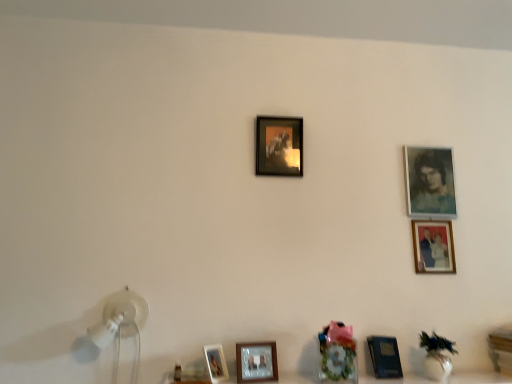
Question: Is blue textured portrait at upper right, the first picture frame when ordered from right to left, placed right next to matte glass picture frame at center, which appears as the third picture frame when ordered from the bottom?

Choices:
 (A) no
 (B) yes

Answer: (A)

Question: Is blue textured portrait at upper right, which ranks as the second picture frame in top-to-bottom order, facing towards matte glass picture frame at center, the 5th picture frame positioned from the right?

Choices:
 (A) no
 (B) yes

Answer: (A)

Question: Are blue textured portrait at upper right, which appears as the sixth picture frame when viewed from the left, and matte glass picture frame at center, the 5th picture frame positioned from the right, far apart?

Choices:
 (A) no
 (B) yes

Answer: (A)

Question: Considering the relative sizes of blue textured portrait at upper right, which ranks as the second picture frame in top-to-bottom order, and matte glass picture frame at center, which ranks as the 2th picture frame in left-to-right order, in the image provided, is blue textured portrait at upper right, which ranks as the second picture frame in top-to-bottom order, thinner than matte glass picture frame at center, which ranks as the 2th picture frame in left-to-right order,?

Choices:
 (A) yes
 (B) no

Answer: (A)

Question: Does blue textured portrait at upper right, the first picture frame when ordered from right to left, appear on the right side of matte glass picture frame at center, positioned as the fourth picture frame in top-to-bottom order?

Choices:
 (A) yes
 (B) no

Answer: (A)

Question: Would you say blue textured portrait at upper right, which appears as the sixth picture frame when viewed from the left, contains matte glass picture frame at center, which appears as the third picture frame when ordered from the bottom?

Choices:
 (A) no
 (B) yes

Answer: (A)

Question: Considering the relative sizes of wooden table at lower right and matte black picture frame at center, the sixth picture frame ordered from the bottom, in the image provided, is wooden table at lower right wider than matte black picture frame at center, the sixth picture frame ordered from the bottom,?

Choices:
 (A) no
 (B) yes

Answer: (B)

Question: Considering the relative sizes of wooden table at lower right and matte black picture frame at center, the 1th picture frame from the top, in the image provided, is wooden table at lower right taller than matte black picture frame at center, the 1th picture frame from the top,?

Choices:
 (A) no
 (B) yes

Answer: (A)

Question: Is wooden table at lower right not close to matte black picture frame at center, the sixth picture frame ordered from the bottom?

Choices:
 (A) yes
 (B) no

Answer: (A)

Question: Is wooden table at lower right touching matte black picture frame at center, the 4th picture frame positioned from the right?

Choices:
 (A) yes
 (B) no

Answer: (B)

Question: From a real-world perspective, is wooden table at lower right beneath matte black picture frame at center, the sixth picture frame ordered from the bottom?

Choices:
 (A) yes
 (B) no

Answer: (A)

Question: From a real-world perspective, is wooden table at lower right located higher than matte black picture frame at center, the 1th picture frame from the top?

Choices:
 (A) yes
 (B) no

Answer: (B)

Question: From a real-world perspective, is wooden table at lower right located beneath white glossy table lamp at lower left?

Choices:
 (A) no
 (B) yes

Answer: (B)